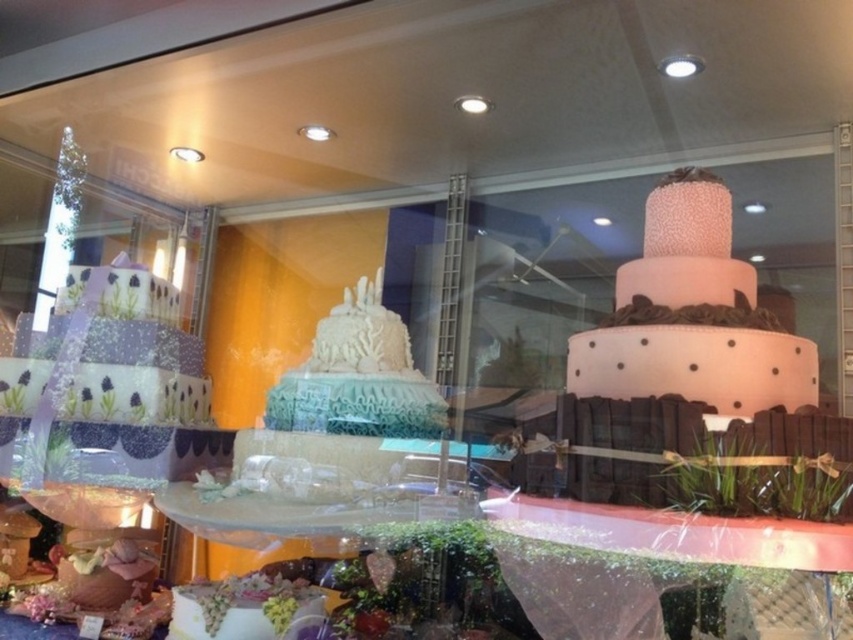
Who is positioned more to the right, pink textured cake at center or white textured cake at lower center?

From the viewer's perspective, pink textured cake at center appears more on the right side.

Image resolution: width=853 pixels, height=640 pixels. Find the location of `pink textured cake at center`. pink textured cake at center is located at coordinates (692, 316).

Is point (408, 420) closer to camera compared to point (201, 589)?

No, (408, 420) is behind (201, 589).

Is the position of white textured cake at center more distant than that of white textured cake at lower center?

Yes, white textured cake at center is behind white textured cake at lower center.

Locate an element on the screen. white textured cake at center is located at coordinates (358, 376).

Consider the image. Can you confirm if pink textured cake at center is shorter than white textured cake at center?

No.

Which is in front, point (601, 387) or point (351, 369)?

Positioned in front is point (601, 387).

Locate an element on the screen. pink textured cake at center is located at coordinates (692, 316).